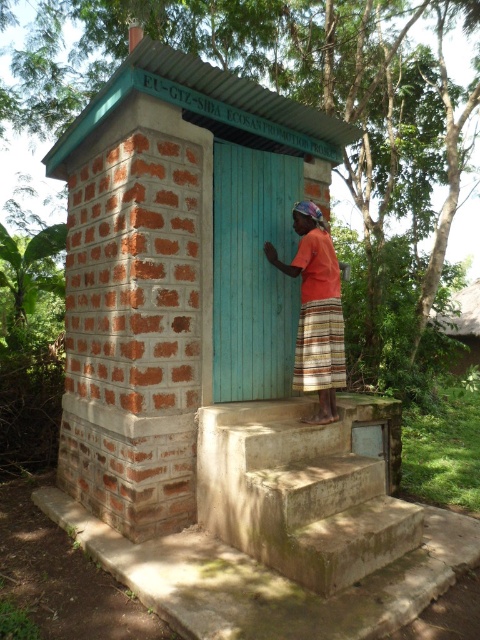
Question: Which of the following is the closest to the observer?

Choices:
 (A) concrete stairs at center
 (B) brick hut at center

Answer: (A)

Question: Is concrete stairs at center bigger than orange cotton shirt at center?

Choices:
 (A) yes
 (B) no

Answer: (A)

Question: Does brick hut at center appear on the right side of orange cotton shirt at center?

Choices:
 (A) yes
 (B) no

Answer: (B)

Question: Among these objects, which one is nearest to the camera?

Choices:
 (A) concrete stairs at center
 (B) brick hut at center
 (C) orange cotton shirt at center

Answer: (A)

Question: Which point is closer to the camera?

Choices:
 (A) brick hut at center
 (B) orange cotton shirt at center
 (C) concrete stairs at center

Answer: (C)

Question: Observing the image, what is the correct spatial positioning of brick hut at center in reference to concrete stairs at center?

Choices:
 (A) left
 (B) right

Answer: (A)